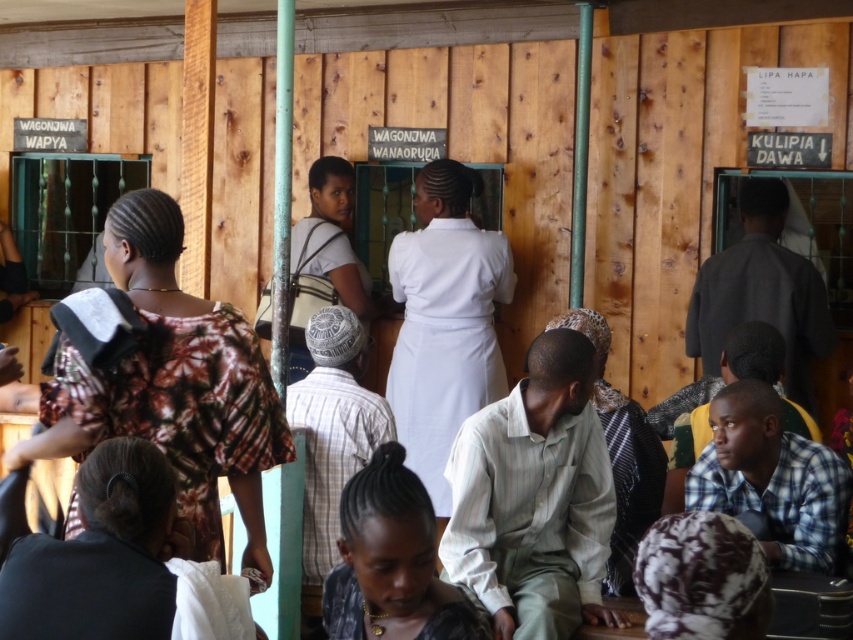
You are a visitor in this public service office and need to find the staff member wearing the white smooth uniform at center. According to the scene description, where should you look to find them?

The white smooth uniform at center is located at point [444,321], so you should look at the center of the image to find the staff member.

You are a photographer taking a photo of the scene. You notice the printed fabric dress at left and the light brown fabric headscarf at lower center. Which object is closer to the camera?

The printed fabric dress at left is closer to the camera because it is in front of the light brown fabric headscarf at lower center.

You are a photographer taking a picture of the scene. You want to ensure both the printed fabric dress at left and the black textured hair at center are clearly visible in your frame. Based on their positions, which object should you focus on first to ensure both are in focus?

The printed fabric dress at left is positioned on the left side of black textured hair at center. To ensure both are in focus, you should focus on the printed fabric dress at left first since it is closer to the camera, allowing the depth of field to cover the black textured hair at center.